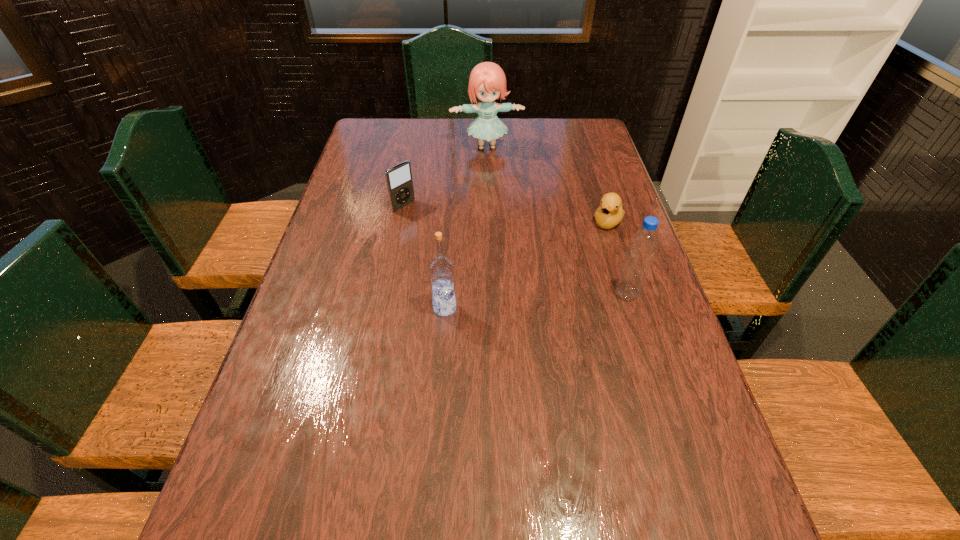
This screenshot has height=540, width=960. I want to click on vacant space located 0.380m on the front-facing side of the doll, so click(502, 225).

Locate an element on the screen. free space located 0.350m on the front-facing side of the doll is located at coordinates (500, 219).

At what (x,y) coordinates should I click in order to perform the action: click on vacant space located 0.240m on the face of the shortest object. Please return your answer as a coordinate pair (x, y). This screenshot has height=540, width=960. Looking at the image, I should click on (568, 282).

Locate an element on the screen. The width and height of the screenshot is (960, 540). free space located 0.180m on the face of the shortest object is located at coordinates click(578, 268).

The width and height of the screenshot is (960, 540). I want to click on free space located on the face of the shortest object, so click(557, 299).

Find the location of a particular element. free location located 0.300m on the front-facing side of the second shortest object is located at coordinates (479, 258).

In order to click on vacant space situated 0.300m on the front-facing side of the second shortest object in this screenshot , I will do tap(479, 258).

This screenshot has width=960, height=540. Identify the location of vacant region located on the front-facing side of the second shortest object. (422, 219).

You are a GUI agent. You are given a task and a screenshot of the screen. Output one action in this format:
    pyautogui.click(x=<x>, y=<y>)
    Task: Click on the object present at the far edge
    This screenshot has width=960, height=540.
    Given the screenshot: What is the action you would take?
    pyautogui.click(x=487, y=82)

What are the coordinates of `water bottle located at the right edge` in the screenshot? It's located at (642, 246).